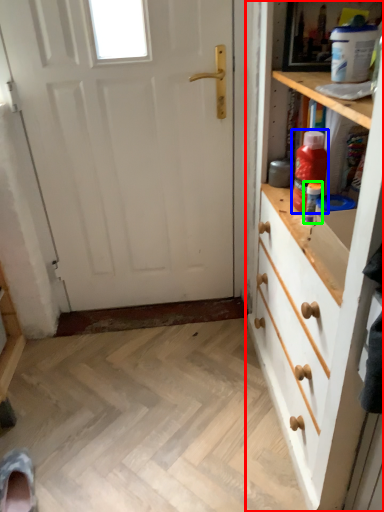
Question: Estimate the real-world distances between objects in this image. Which object is closer to chest of drawers (highlighted by a red box), bottle (highlighted by a blue box) or bottle (highlighted by a green box)?

Choices:
 (A) bottle
 (B) bottle

Answer: (A)